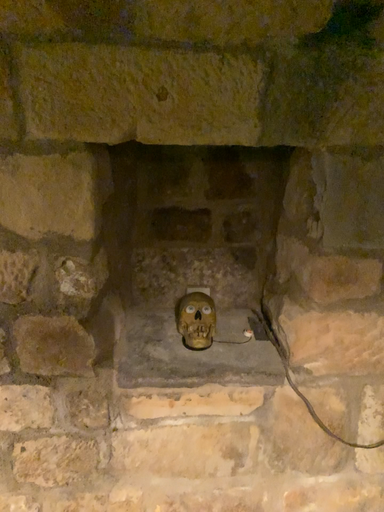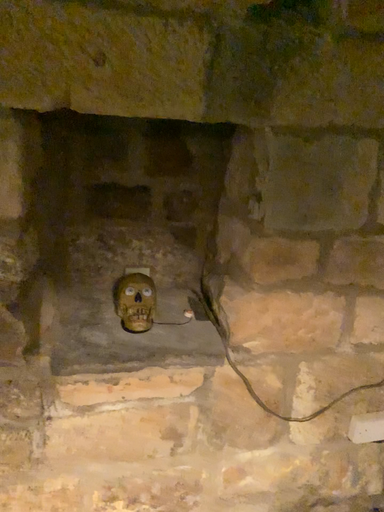
Question: Which way did the camera rotate in the video?

Choices:
 (A) rotated left
 (B) rotated right

Answer: (B)